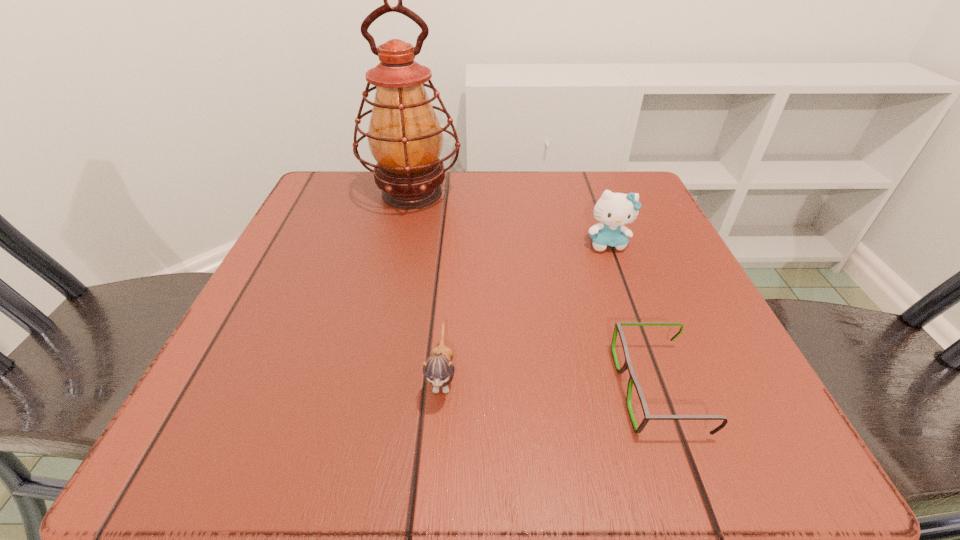
This screenshot has height=540, width=960. I want to click on object that is at the near right corner, so click(x=618, y=329).

Where is `free space at the far edge of the desktop`? free space at the far edge of the desktop is located at coordinates pos(464,177).

At what (x,y) coordinates should I click in order to perform the action: click on free region at the near edge of the desktop. Please return your answer as a coordinate pair (x, y). Looking at the image, I should click on click(x=478, y=420).

In the image, there is a desktop. At what (x,y) coordinates should I click in order to perform the action: click on free space at the left edge. Please return your answer as a coordinate pair (x, y). This screenshot has height=540, width=960. Looking at the image, I should click on (264, 385).

Identify the location of vacant space at the right edge. This screenshot has width=960, height=540. (707, 305).

Where is `vacant point at the far left corner`? The height and width of the screenshot is (540, 960). vacant point at the far left corner is located at coordinates (353, 206).

Identify the location of free space at the near left corner of the desktop. (269, 403).

You are a GUI agent. You are given a task and a screenshot of the screen. Output one action in this format:
    pyautogui.click(x=<x>, y=<y>)
    Task: Click on the blank space at the far right corner of the desktop
    
    Given the screenshot: What is the action you would take?
    pyautogui.click(x=627, y=191)

Where is `vacant space at the near right corner of the desktop`? vacant space at the near right corner of the desktop is located at coordinates (687, 463).

What are the coordinates of `free space between the third shortest object and the farthest object` in the screenshot? It's located at (510, 219).